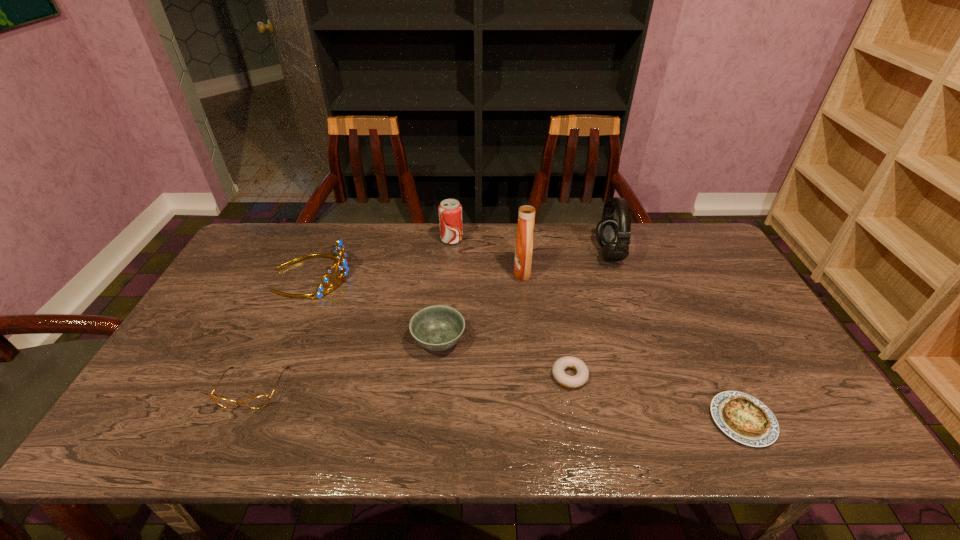
What are the coordinates of `blank space located 0.230m on the back of the rightmost object` in the screenshot? It's located at (694, 324).

At what (x,y) coordinates should I click in order to perform the action: click on detergent at the far edge. Please return your answer as a coordinate pair (x, y). The width and height of the screenshot is (960, 540). Looking at the image, I should click on tap(524, 240).

The width and height of the screenshot is (960, 540). In order to click on headset that is at the far edge in this screenshot , I will do `click(612, 235)`.

At what (x,y) coordinates should I click in order to perform the action: click on soda can that is at the far edge. Please return your answer as a coordinate pair (x, y). Looking at the image, I should click on (450, 210).

This screenshot has height=540, width=960. What are the coordinates of `tiara at the far edge` in the screenshot? It's located at (338, 250).

Image resolution: width=960 pixels, height=540 pixels. I want to click on object that is at the near edge, so click(742, 417).

This screenshot has width=960, height=540. I want to click on object present at the left edge, so click(338, 250).

What are the coordinates of `object that is at the right edge` in the screenshot? It's located at (742, 417).

The image size is (960, 540). In order to click on object that is positioned at the far left corner in this screenshot , I will do `click(338, 250)`.

This screenshot has height=540, width=960. I want to click on object at the near right corner, so click(x=742, y=417).